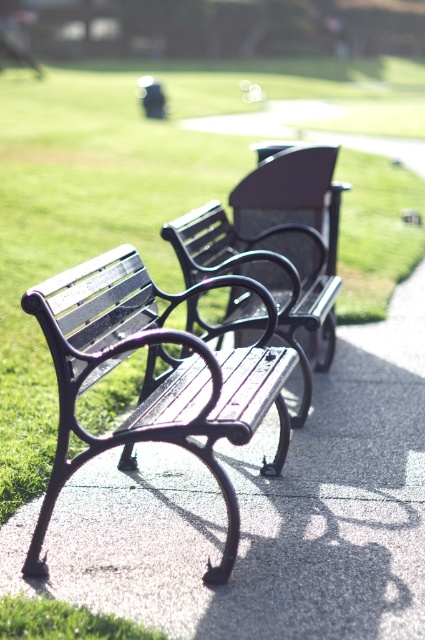
You need to sit on one of the two benches in the park. The matte black bench at center and the wooden bench at center are both available. Which bench has more seating space?

The wooden bench at center has more seating space because the matte black bench at center occupies less space than the wooden bench at center.

You are a gardener who needs to mow the green grass at center. However, there is a wooden bench at center in the way. Can you mow the grass easily without moving the bench?

The green grass at center is located above the wooden bench at center, meaning the grass is growing over the bench. This would make it difficult to mow the grass without moving the bench first.